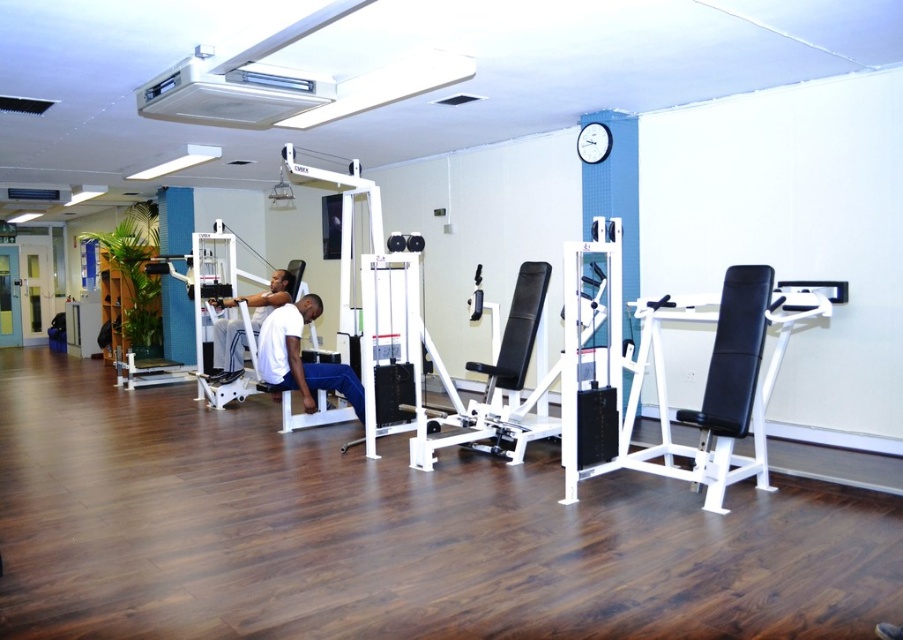
Question: Can you confirm if white matte bench at center is wider than white matte weight machine at center?

Choices:
 (A) yes
 (B) no

Answer: (B)

Question: Which point is closer to the camera taking this photo?

Choices:
 (A) (305, 400)
 (B) (252, 316)

Answer: (A)

Question: Which of the following is the closest to the observer?

Choices:
 (A) (309, 307)
 (B) (225, 340)

Answer: (A)

Question: Is white matte bench at center wider than white matte weight machine at center?

Choices:
 (A) yes
 (B) no

Answer: (B)

Question: Can you confirm if white matte bench at center is positioned to the right of white matte weight machine at center?

Choices:
 (A) no
 (B) yes

Answer: (B)